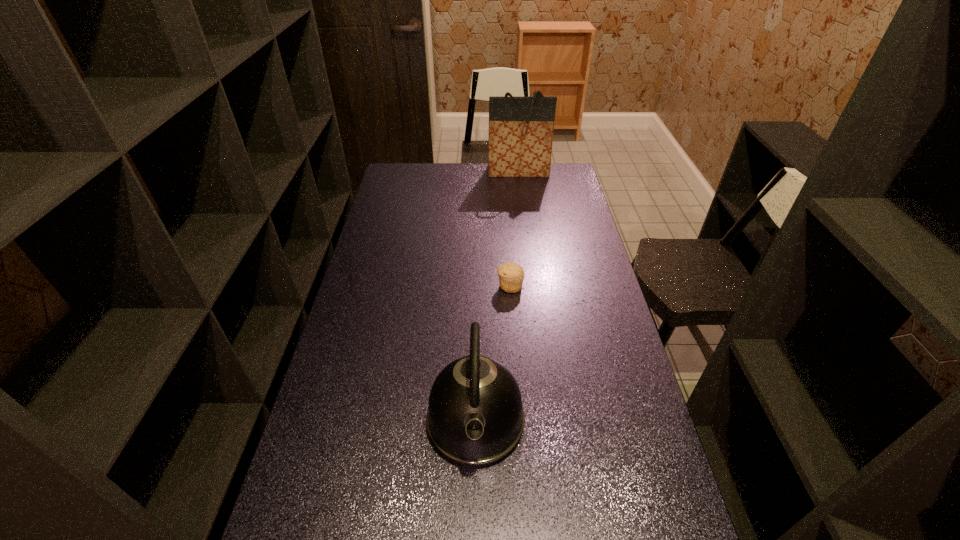
The image size is (960, 540). I want to click on object that is at the right edge, so click(x=521, y=129).

Locate an element on the screen. object present at the far right corner is located at coordinates (x=521, y=129).

This screenshot has height=540, width=960. In the image, there is a desktop. What are the coordinates of `vacant space at the far edge` in the screenshot? It's located at (466, 176).

This screenshot has width=960, height=540. I want to click on blank space at the left edge of the desktop, so click(x=389, y=287).

The height and width of the screenshot is (540, 960). In the image, there is a desktop. Find the location of `free region at the right edge`. free region at the right edge is located at coordinates (632, 490).

Identify the location of vacant space at the far right corner of the desktop. (559, 169).

Find the location of a particular element. free space between the muffin and the tallest object is located at coordinates (515, 229).

Locate an element on the screen. vacant area that lies between the shopping bag and the second nearest object is located at coordinates (515, 229).

I want to click on vacant area that lies between the second farthest object and the second tallest object, so click(492, 353).

Locate an element on the screen. This screenshot has width=960, height=540. free area in between the nearest object and the shortest object is located at coordinates (492, 353).